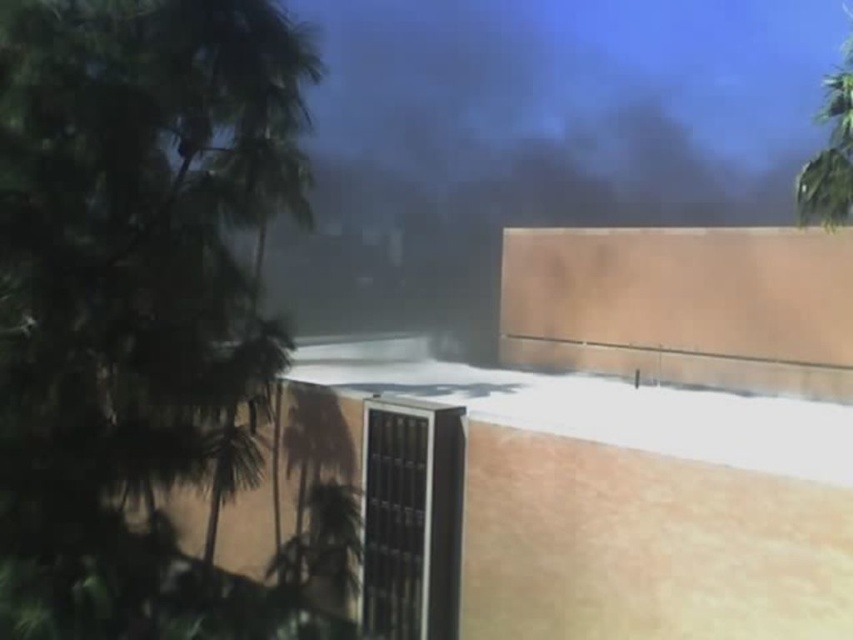
You are standing in front of the building with the security gate. There are two points marked in the image. One is at coordinates point (122, 168) and the other at point (799, 170). Which point is closer to you?

The point (122, 168) is closer to the viewer than point (799, 170).

You are standing in the middle of the image and looking towards the green leafy tree at left and the green leafy tree at upper right. Which tree is closer to your current position?

The green leafy tree at left is closer to your current position because it is positioned below the green leafy tree at upper right, indicating it is nearer in the visual plane.